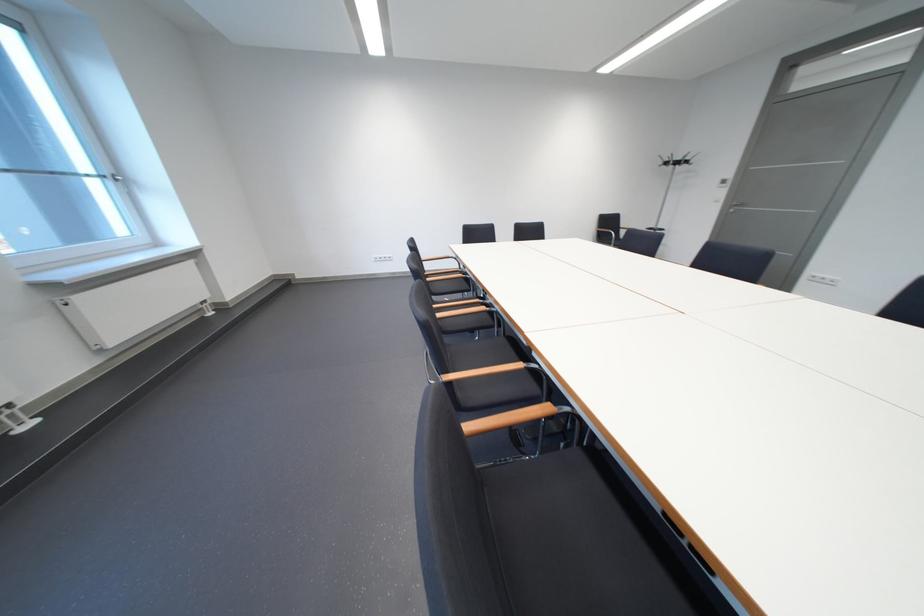
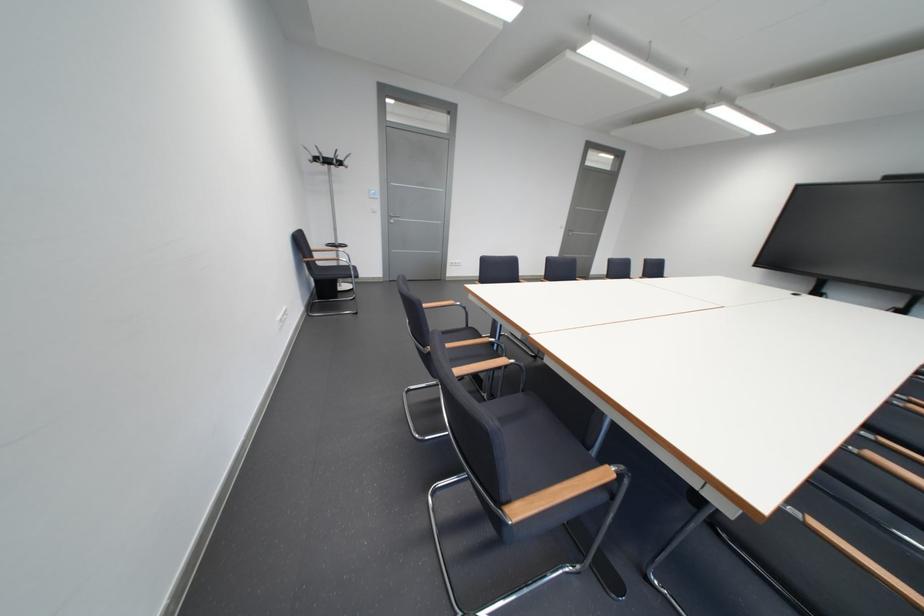
In the second image, find the point that corresponds to point 678,164 in the first image.

(330, 161)